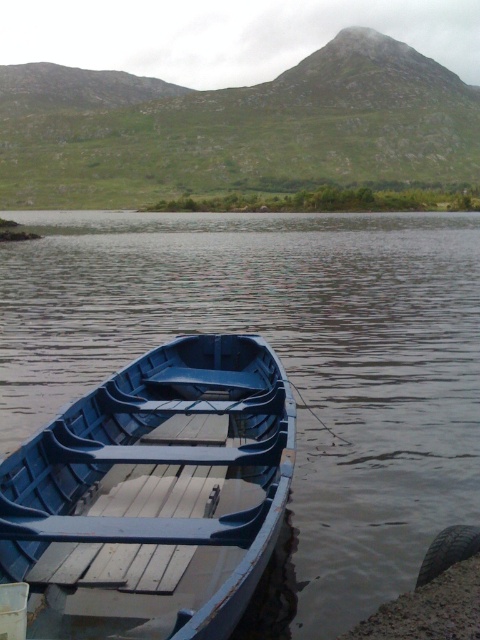
Question: Does blue wood boat at center appear on the right side of matte blue boat at lower left?

Choices:
 (A) yes
 (B) no

Answer: (B)

Question: Which point appears farthest from the camera in this image?

Choices:
 (A) (411, 476)
 (B) (224, 616)

Answer: (A)

Question: Which object is farther from the camera taking this photo?

Choices:
 (A) blue wood boat at center
 (B) matte blue boat at lower left

Answer: (B)

Question: Does blue wood boat at center have a greater width compared to matte blue boat at lower left?

Choices:
 (A) no
 (B) yes

Answer: (B)

Question: Is blue wood boat at center closer to camera compared to matte blue boat at lower left?

Choices:
 (A) yes
 (B) no

Answer: (A)